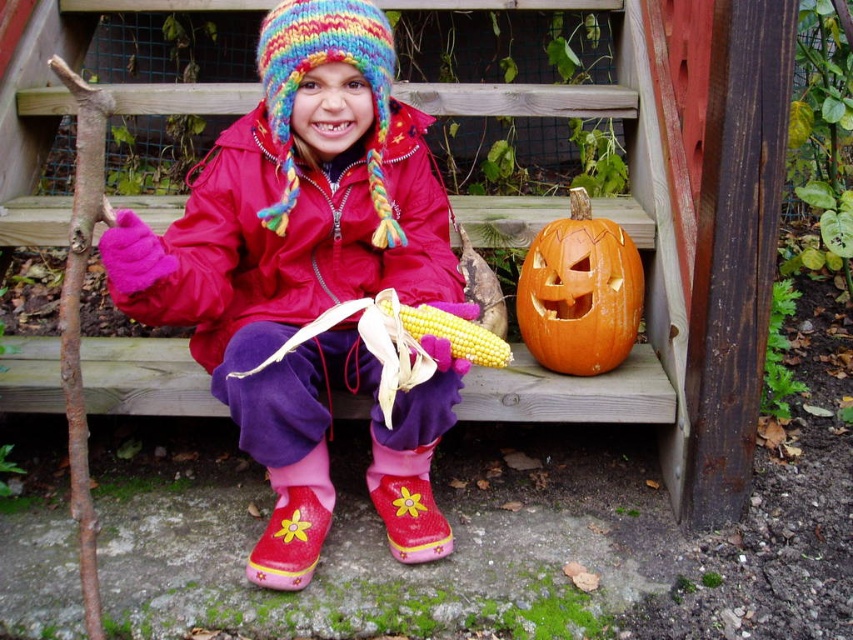
You are a photographer trying to capture a photo of the orange matte pumpkin at lower right. You are standing at the position where the matte pink rubber boots at center are. Which direction should you move to get a clear shot of the pumpkin?

The matte pink rubber boots at center is positioned on the left side of the orange matte pumpkin at lower right. To get a clear shot of the orange matte pumpkin at lower right, you should move to the right side of the matte pink rubber boots at center.

You are a photographer taking a picture of the scene. You want to focus on the orange matte pumpkin at lower right but need to ensure the matte pink rubber boots at center won

The matte pink rubber boots at center is closer to the viewer than the orange matte pumpkin at lower right. To focus on the orange matte pumpkin at lower right, you may need to adjust your position or angle to ensure it is in the foreground or use a camera setting that prioritizes depth of field for the pumpkin.